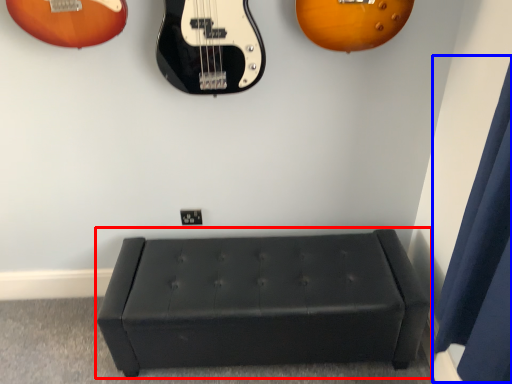
Question: Which object is further to the camera taking this photo, furniture (highlighted by a red box) or curtain (highlighted by a blue box)?

Choices:
 (A) furniture
 (B) curtain

Answer: (A)